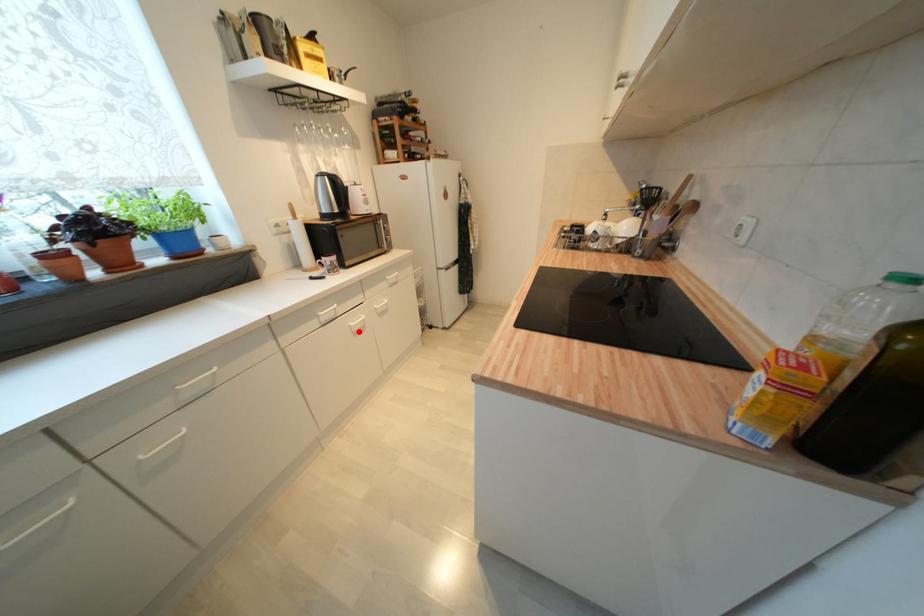
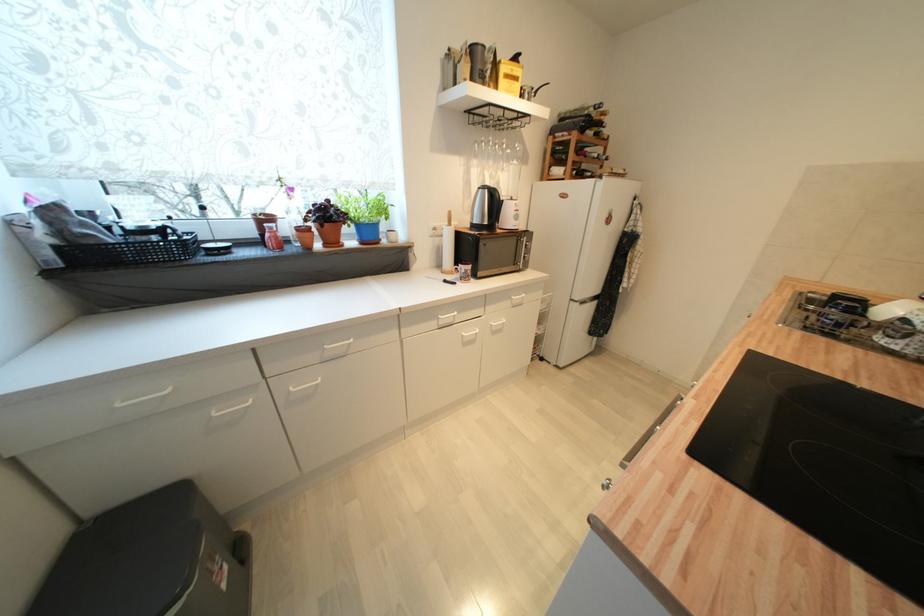
Question: I am providing you with two images of the same scene from different viewpoints. Given a red point in image1, look at the same physical point in image2. Is it:

Choices:
 (A) Closer to the viewpoint
 (B) Farther from the viewpoint

Answer: (B)